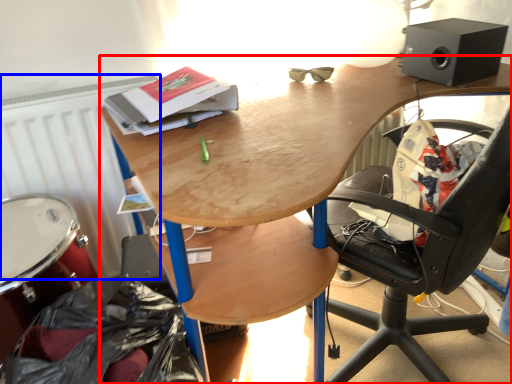
Question: Which object is closer to the camera taking this photo, desk (highlighted by a red box) or radiator (highlighted by a blue box)?

Choices:
 (A) desk
 (B) radiator

Answer: (A)